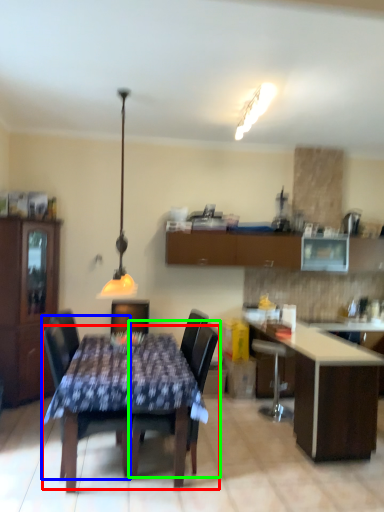
Question: Which object is positioned closest to kitchen & dining room table (highlighted by a red box)? Select from chair (highlighted by a blue box) and chair (highlighted by a green box).

Choices:
 (A) chair
 (B) chair

Answer: (B)